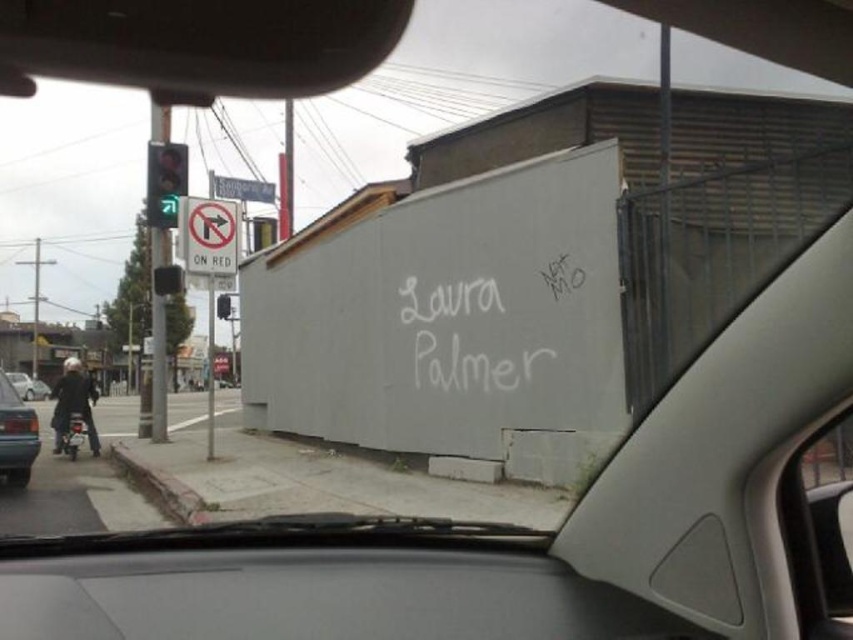
Question: Observing the image, what is the correct spatial positioning of white plastic sign at upper left in reference to green glass traffic light at center?

Choices:
 (A) above
 (B) below

Answer: (A)

Question: Does green matte car at lower left have a lesser width compared to metallic silver motorcycle at left?

Choices:
 (A) no
 (B) yes

Answer: (B)

Question: Which is farther from the green matte car at lower left?

Choices:
 (A) green glass traffic light at center
 (B) white chalk writing at center
 (C) green glass traffic light at left

Answer: (C)

Question: Estimate the real-world distances between objects in this image. Which object is closer to the green matte car at lower left?

Choices:
 (A) white plastic sign at upper left
 (B) green glass traffic light at center
 (C) white plastic sign at upper center

Answer: (A)

Question: Based on their relative distances, which object is farther from the green glass traffic light at left?

Choices:
 (A) green matte car at lower left
 (B) white chalk writing at center

Answer: (A)

Question: Does white plastic sign at upper center appear on the left side of green glass traffic light at center?

Choices:
 (A) yes
 (B) no

Answer: (A)